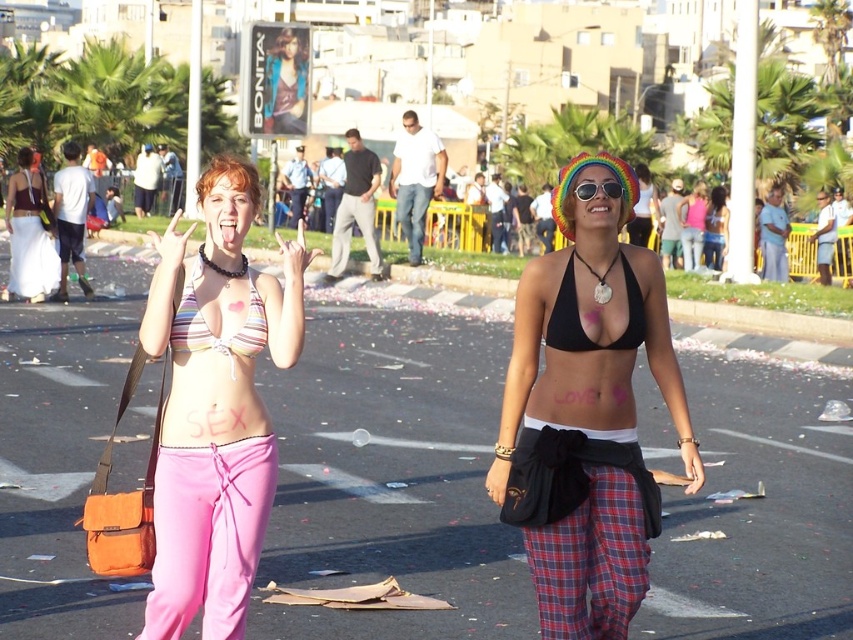
Question: Estimate the real-world distances between objects in this image. Which object is closer to the matte white dress at left?

Choices:
 (A) multicolored fabric bikini top at center
 (B) blonde hair at center
 (C) black fabric bikini top at center

Answer: (A)

Question: Does white cotton bikini top at center have a larger size compared to multicolored fabric bikini top at center?

Choices:
 (A) yes
 (B) no

Answer: (A)

Question: From the image, what is the correct spatial relationship of multicolored fabric bikini top at center in relation to multicolored plastic goggles at center?

Choices:
 (A) right
 (B) left

Answer: (B)

Question: Which object is positioned closest to the multicolored fabric bikini top at center?

Choices:
 (A) pink fabric bikini bottom at lower left
 (B) black fabric bikini top at center
 (C) matte black bikini top at center
 (D) blonde hair at center

Answer: (D)

Question: Does black fabric bikini top at center appear on the right side of matte black bikini top at center?

Choices:
 (A) no
 (B) yes

Answer: (A)

Question: Which point is farther to the camera?

Choices:
 (A) (202, 342)
 (B) (576, 184)
 (C) (33, 252)

Answer: (C)